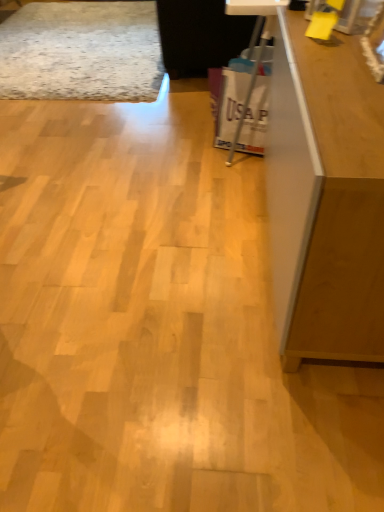
Locate an element on the screen. vacant area in front of white plastic bag at center is located at coordinates (233, 169).